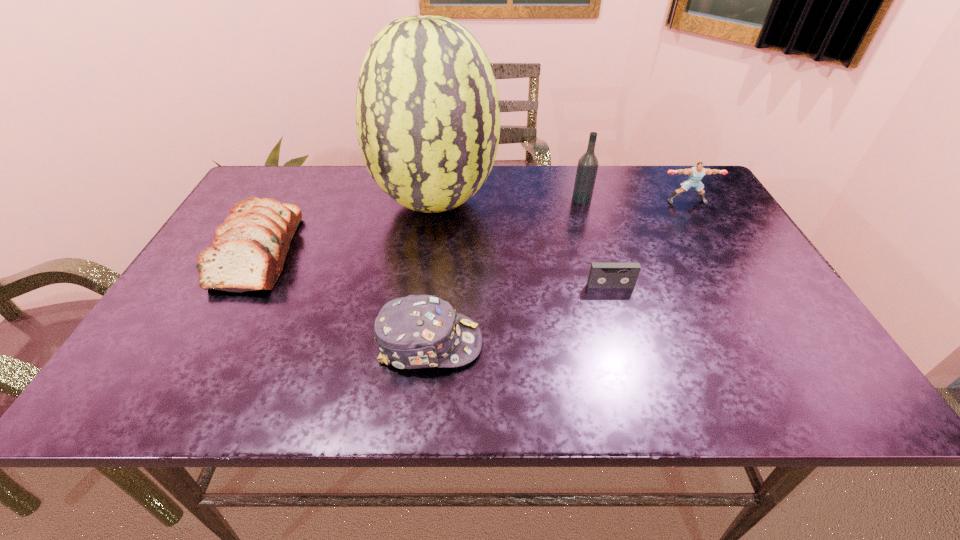
Locate an element on the screen. object at the far right corner is located at coordinates (696, 173).

Locate an element on the screen. This screenshot has width=960, height=540. vacant region at the far edge of the desktop is located at coordinates (345, 184).

The height and width of the screenshot is (540, 960). Find the location of `free location at the near edge`. free location at the near edge is located at coordinates (590, 387).

You are a GUI agent. You are given a task and a screenshot of the screen. Output one action in this format:
    pyautogui.click(x=<x>, y=<y>)
    Task: Click on the free space between the videotape and the puncher
    This screenshot has width=960, height=540.
    Given the screenshot: What is the action you would take?
    pyautogui.click(x=649, y=244)

The image size is (960, 540). What are the coordinates of `free space between the bread and the shortest object` in the screenshot? It's located at (436, 267).

You are a GUI agent. You are given a task and a screenshot of the screen. Output one action in this format:
    pyautogui.click(x=<x>, y=<y>)
    Task: Click on the free space that is in between the vodka and the bread
    
    Given the screenshot: What is the action you would take?
    pyautogui.click(x=421, y=224)

The height and width of the screenshot is (540, 960). Find the location of `free point between the headwear and the watermelon`. free point between the headwear and the watermelon is located at coordinates (432, 273).

Where is `vacant space that is in between the bread and the videotape`? This screenshot has width=960, height=540. vacant space that is in between the bread and the videotape is located at coordinates (436, 267).

You are a GUI agent. You are given a task and a screenshot of the screen. Output one action in this format:
    pyautogui.click(x=<x>, y=<y>)
    Task: Click on the free space between the second tallest object and the videotape
    Image resolution: width=960 pixels, height=540 pixels.
    Given the screenshot: What is the action you would take?
    pyautogui.click(x=596, y=242)

This screenshot has height=540, width=960. Find the location of `vacant area that lies between the vodka and the puncher`. vacant area that lies between the vodka and the puncher is located at coordinates (635, 200).